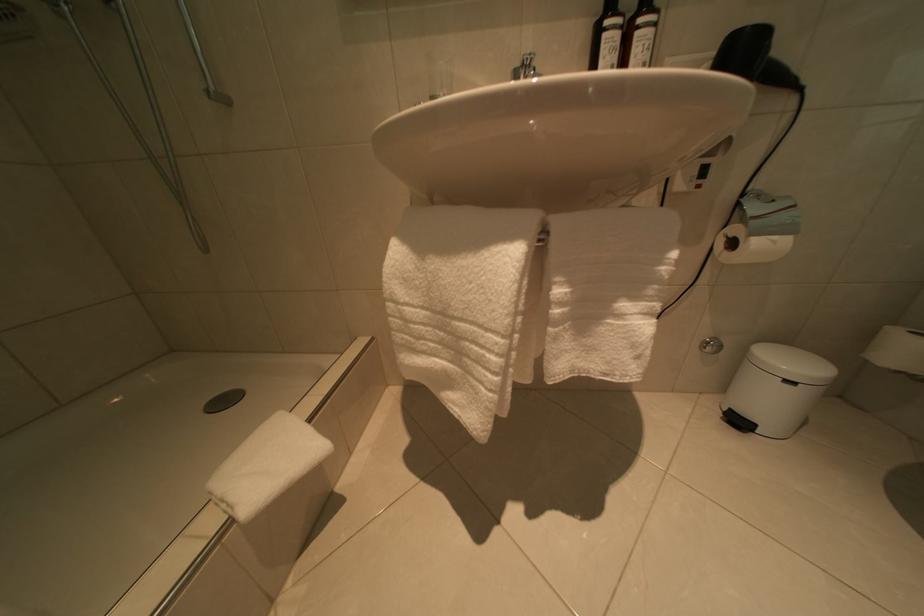
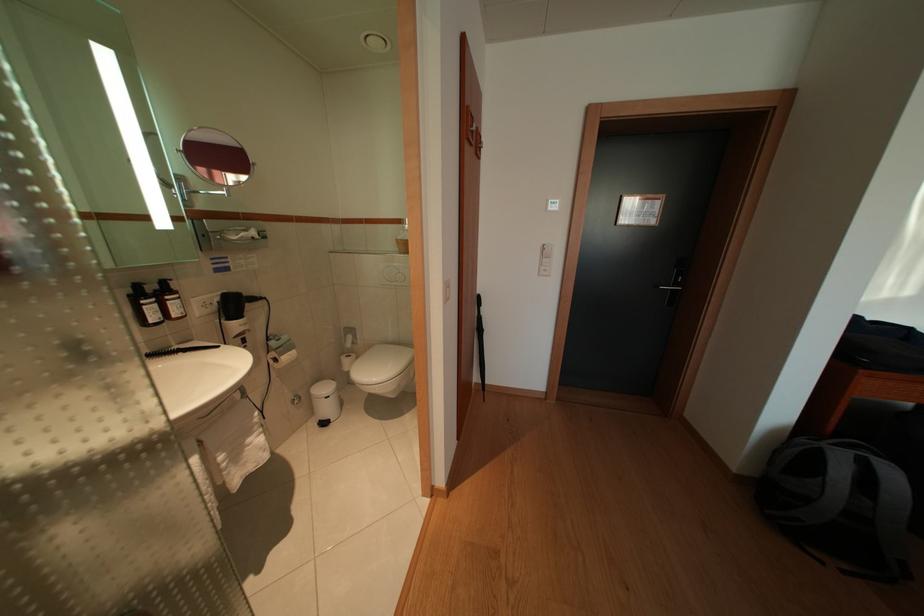
Question: The camera is either moving clockwise (left) or counter-clockwise (right) around the object. The first image is from the beginning of the video and the second image is from the end. Is the camera moving left or right when shooting the video?

Choices:
 (A) Left
 (B) Right

Answer: (A)